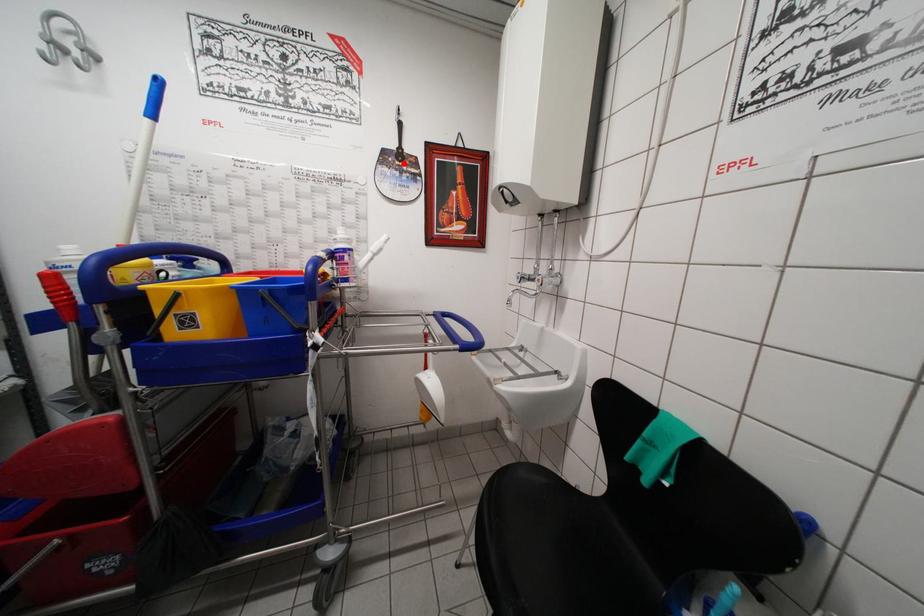
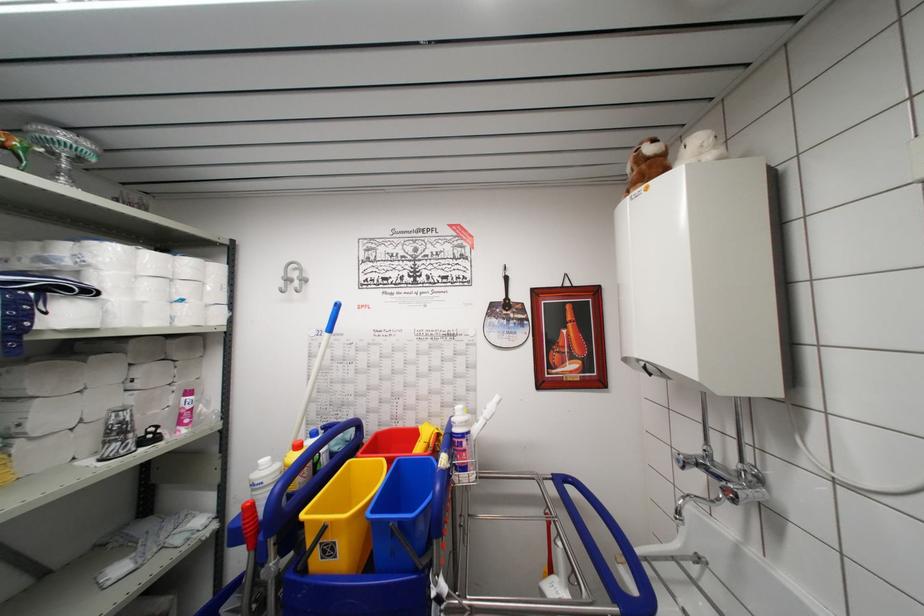
Where in the second image is the point corresponding to the highlighted location from the first image?

(511, 313)